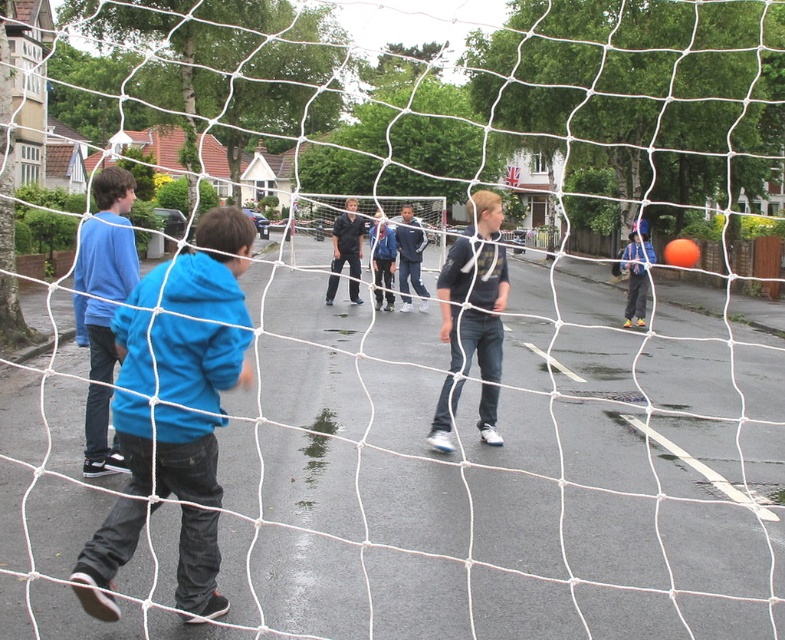
Question: Which point is closer to the camera?

Choices:
 (A) (221, 260)
 (B) (112, 442)
 (C) (487, 305)

Answer: (A)

Question: Does dark blue t-shirt at center lie behind matte blue hoodie at left?

Choices:
 (A) yes
 (B) no

Answer: (A)

Question: Which object is farther from the camera taking this photo?

Choices:
 (A) matte blue hoodie at left
 (B) blue fleece jacket at left

Answer: (A)

Question: Is blue fleece jacket at left further to the viewer compared to dark blue t-shirt at center?

Choices:
 (A) yes
 (B) no

Answer: (B)

Question: Is blue fleece jacket at left wider than matte blue hoodie at left?

Choices:
 (A) yes
 (B) no

Answer: (A)

Question: Which of the following is the closest to the observer?

Choices:
 (A) dark blue t-shirt at center
 (B) matte blue hoodie at left
 (C) blue fleece jacket at left

Answer: (C)